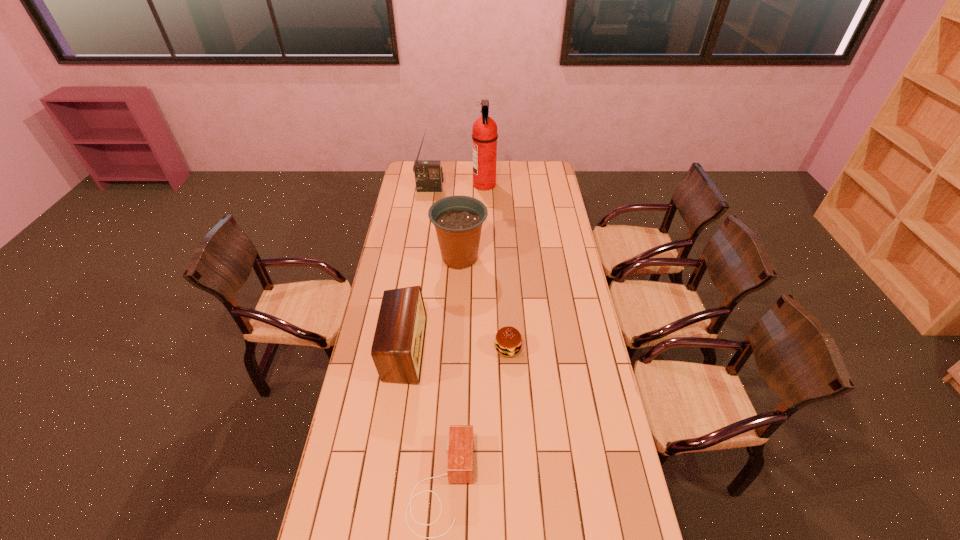
Identify the location of the tallest object. point(484,129).

Locate an element on the screen. The image size is (960, 540). the tallest radio receiver is located at coordinates (428, 174).

The image size is (960, 540). Find the location of `the farthest radio receiver`. the farthest radio receiver is located at coordinates 428,174.

Identify the location of the fourth nearest object. (458, 220).

You are a GUI agent. You are given a task and a screenshot of the screen. Output one action in this format:
    pyautogui.click(x=<x>, y=<y>)
    Task: Click on the flowerpot
    
    Given the screenshot: What is the action you would take?
    pyautogui.click(x=458, y=220)

The height and width of the screenshot is (540, 960). What are the coordinates of `the third shortest object` in the screenshot? It's located at (397, 350).

Locate an element on the screen. The height and width of the screenshot is (540, 960). the second shortest radio receiver is located at coordinates (397, 350).

This screenshot has height=540, width=960. Find the location of `hamburger`. hamburger is located at coordinates (508, 339).

This screenshot has height=540, width=960. Identify the location of the shortest radio receiver. (459, 446).

Locate an element on the screen. This screenshot has height=540, width=960. the nearest radio receiver is located at coordinates (459, 446).